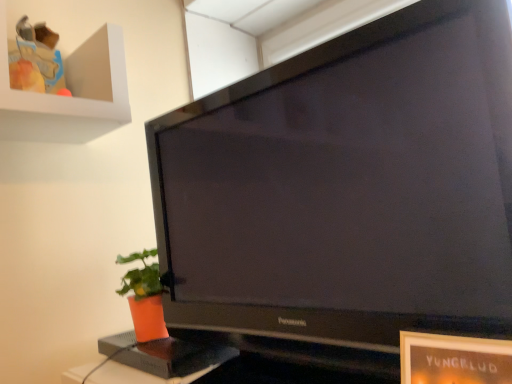
Question: From their relative heights in the image, would you say black glossy television at center is taller or shorter than orange matte pot at lower left?

Choices:
 (A) short
 (B) tall

Answer: (B)

Question: Is point (487, 225) closer or farther from the camera than point (141, 339)?

Choices:
 (A) closer
 (B) farther

Answer: (A)

Question: Is black glossy television at center situated inside orange matte pot at lower left or outside?

Choices:
 (A) outside
 (B) inside

Answer: (A)

Question: Looking at their shapes, would you say orange matte pot at lower left is wider or thinner than black glossy television at center?

Choices:
 (A) thin
 (B) wide

Answer: (A)

Question: Relative to black glossy television at center, is orange matte pot at lower left in front or behind?

Choices:
 (A) behind
 (B) front

Answer: (A)

Question: Is orange matte pot at lower left bigger or smaller than black glossy television at center?

Choices:
 (A) small
 (B) big

Answer: (A)

Question: Is point (125, 274) closer or farther from the camera than point (432, 62)?

Choices:
 (A) farther
 (B) closer

Answer: (A)